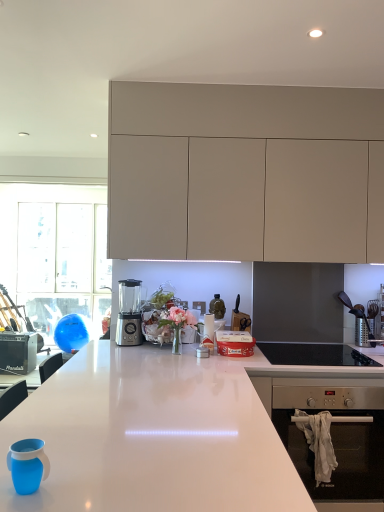
Identify the location of free location to the right of teal silicone cup at lower left. The width and height of the screenshot is (384, 512). (86, 479).